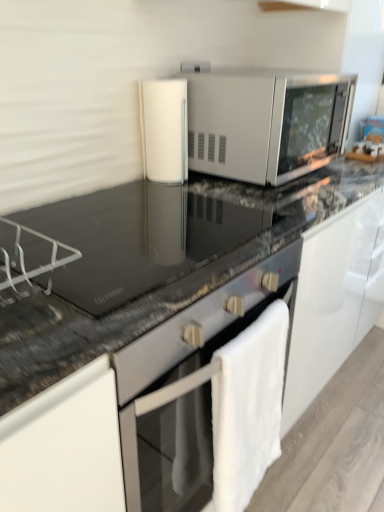
Question: Considering the relative positions of white glossy cylindrical container at center and white fluffy bath towel at lower right in the image provided, is white glossy cylindrical container at center to the right of white fluffy bath towel at lower right from the viewer's perspective?

Choices:
 (A) yes
 (B) no

Answer: (B)

Question: Is white glossy cylindrical container at center surrounding white fluffy bath towel at lower right?

Choices:
 (A) yes
 (B) no

Answer: (B)

Question: Is white glossy cylindrical container at center located outside white fluffy bath towel at lower right?

Choices:
 (A) yes
 (B) no

Answer: (A)

Question: Is white glossy cylindrical container at center further to camera compared to white fluffy bath towel at lower right?

Choices:
 (A) no
 (B) yes

Answer: (B)

Question: Does white glossy cylindrical container at center have a greater height compared to white fluffy bath towel at lower right?

Choices:
 (A) yes
 (B) no

Answer: (B)

Question: Is point (327, 77) positioned closer to the camera than point (152, 164)?

Choices:
 (A) farther
 (B) closer

Answer: (B)

Question: From the image's perspective, is satin silver microwave at center positioned above or below white glossy cylindrical container at center?

Choices:
 (A) below
 (B) above

Answer: (B)

Question: Considering the positions of satin silver microwave at center and white glossy cylindrical container at center in the image, is satin silver microwave at center wider or thinner than white glossy cylindrical container at center?

Choices:
 (A) thin
 (B) wide

Answer: (B)

Question: Is satin silver microwave at center in front of or behind white glossy cylindrical container at center in the image?

Choices:
 (A) behind
 (B) front

Answer: (B)

Question: In the image, is satin silver microwave at center positioned in front of or behind black glass countertop at center, the first countertop when ordered from top to bottom?

Choices:
 (A) front
 (B) behind

Answer: (B)

Question: From the image's perspective, relative to black glass countertop at center, the first countertop when ordered from top to bottom, is satin silver microwave at center above or below?

Choices:
 (A) below
 (B) above

Answer: (B)

Question: Is satin silver microwave at center spatially inside black glass countertop at center, which is counted as the 2th countertop, starting from the bottom, or outside of it?

Choices:
 (A) outside
 (B) inside

Answer: (A)

Question: From a real-world perspective, is satin silver microwave at center above or below black glass countertop at center, which is counted as the 2th countertop, starting from the bottom?

Choices:
 (A) below
 (B) above

Answer: (B)

Question: In terms of width, does white fluffy bath towel at lower right look wider or thinner when compared to satin silver microwave at center?

Choices:
 (A) wide
 (B) thin

Answer: (B)

Question: From a real-world perspective, is white fluffy bath towel at lower right above or below satin silver microwave at center?

Choices:
 (A) below
 (B) above

Answer: (A)